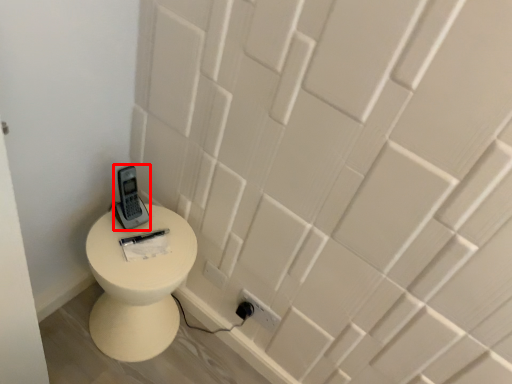
Question: Observing the image, what is the correct spatial positioning of control (annotated by the red box) in reference to toilet?

Choices:
 (A) right
 (B) left

Answer: (A)